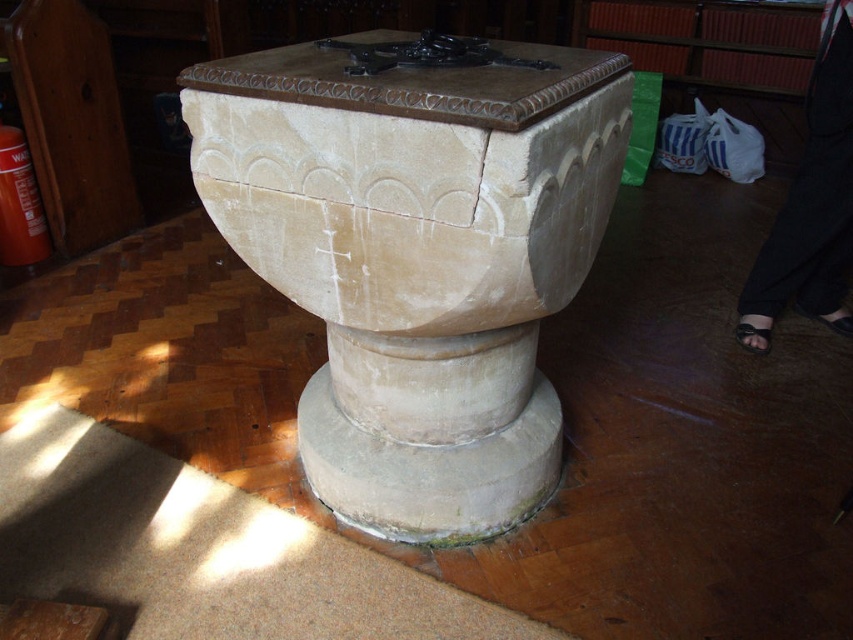
Question: Among these objects, which one is farthest from the camera?

Choices:
 (A) beige stone baptismal font at center
 (B) white stone pedestal at center

Answer: (B)

Question: Can you confirm if beige stone baptismal font at center is positioned to the right of white stone pedestal at center?

Choices:
 (A) no
 (B) yes

Answer: (B)

Question: Which object is closer to the camera taking this photo?

Choices:
 (A) beige stone baptismal font at center
 (B) white stone pedestal at center

Answer: (A)

Question: Is beige stone baptismal font at center thinner than white stone pedestal at center?

Choices:
 (A) yes
 (B) no

Answer: (A)

Question: Is beige stone baptismal font at center bigger than white stone pedestal at center?

Choices:
 (A) yes
 (B) no

Answer: (A)

Question: Which object appears farthest from the camera in this image?

Choices:
 (A) white stone pedestal at center
 (B) beige stone baptismal font at center

Answer: (A)